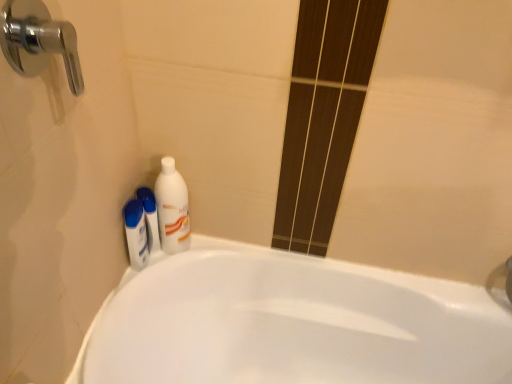
Question: From the image's perspective, does white glossy bathtub at lower left appear lower than white glossy bottle at lower left, the 1th mouthwash from the right?

Choices:
 (A) no
 (B) yes

Answer: (B)

Question: Is white glossy bathtub at lower left facing away from white glossy bottle at lower left, the 1th mouthwash from the right?

Choices:
 (A) yes
 (B) no

Answer: (B)

Question: Is white glossy bathtub at lower left to the left of white glossy bottle at lower left, the 1th mouthwash from the right, from the viewer's perspective?

Choices:
 (A) yes
 (B) no

Answer: (B)

Question: Is white glossy bathtub at lower left touching white glossy bottle at lower left, placed as the 2th mouthwash when sorted from left to right?

Choices:
 (A) yes
 (B) no

Answer: (B)

Question: Does white glossy bathtub at lower left have a smaller size compared to white glossy bottle at lower left, placed as the 2th mouthwash when sorted from left to right?

Choices:
 (A) no
 (B) yes

Answer: (A)

Question: Do you think white glossy mouthwash at lower left, marked as the 2th mouthwash in a right-to-left arrangement, is within white glossy bottle at upper left, or outside of it?

Choices:
 (A) outside
 (B) inside

Answer: (A)

Question: Looking at the image, does white glossy mouthwash at lower left, marked as the first mouthwash in a left-to-right arrangement, seem bigger or smaller compared to white glossy bottle at upper left?

Choices:
 (A) big
 (B) small

Answer: (B)

Question: Considering the positions of white glossy mouthwash at lower left, marked as the first mouthwash in a left-to-right arrangement, and white glossy bottle at upper left in the image, is white glossy mouthwash at lower left, marked as the first mouthwash in a left-to-right arrangement, wider or thinner than white glossy bottle at upper left?

Choices:
 (A) thin
 (B) wide

Answer: (A)

Question: In the image, is white glossy mouthwash at lower left, marked as the first mouthwash in a left-to-right arrangement, positioned in front of or behind white glossy bottle at upper left?

Choices:
 (A) behind
 (B) front

Answer: (A)

Question: Visually, is white glossy mouthwash at lower left, marked as the 2th mouthwash in a right-to-left arrangement, positioned to the left or to the right of chrome metallic faucet at upper left?

Choices:
 (A) left
 (B) right

Answer: (A)

Question: Choose the correct answer: Is white glossy mouthwash at lower left, marked as the first mouthwash in a left-to-right arrangement, inside chrome metallic faucet at upper left or outside it?

Choices:
 (A) inside
 (B) outside

Answer: (B)

Question: In terms of height, does white glossy mouthwash at lower left, marked as the first mouthwash in a left-to-right arrangement, look taller or shorter compared to chrome metallic faucet at upper left?

Choices:
 (A) short
 (B) tall

Answer: (B)

Question: From the image's perspective, is white glossy mouthwash at lower left, marked as the 2th mouthwash in a right-to-left arrangement, positioned above or below chrome metallic faucet at upper left?

Choices:
 (A) below
 (B) above

Answer: (A)

Question: Is chrome metallic faucet at upper left wider or thinner than white glossy bottle at lower left, the 1th mouthwash from the right?

Choices:
 (A) thin
 (B) wide

Answer: (B)

Question: Considering the relative positions of chrome metallic faucet at upper left and white glossy bottle at lower left, placed as the 2th mouthwash when sorted from left to right, in the image provided, is chrome metallic faucet at upper left to the left or to the right of white glossy bottle at lower left, placed as the 2th mouthwash when sorted from left to right,?

Choices:
 (A) left
 (B) right

Answer: (A)